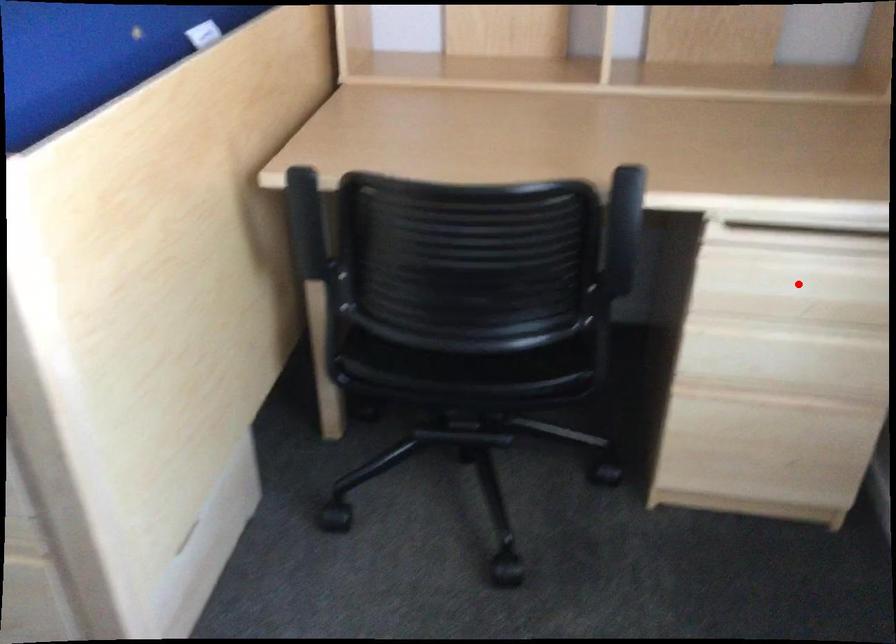
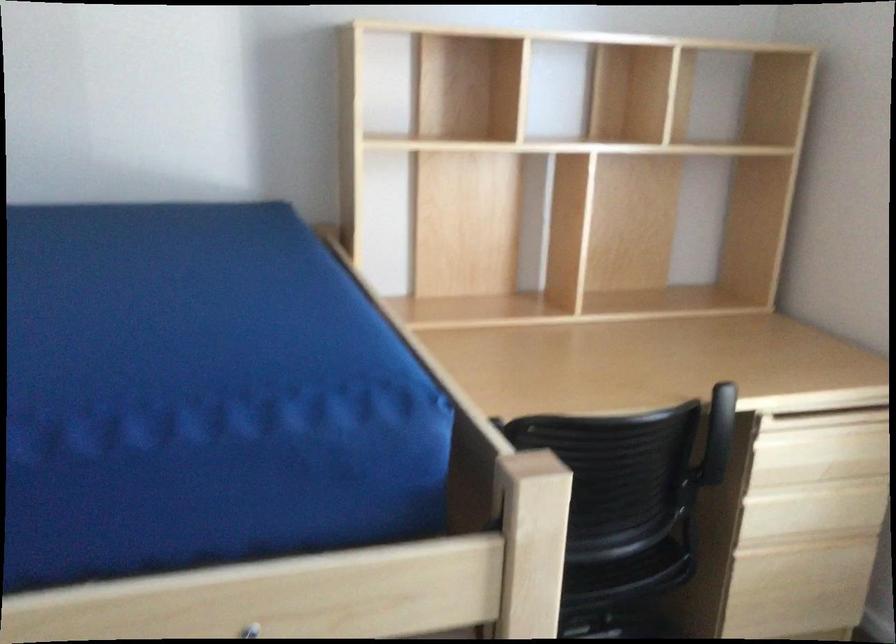
Question: I am providing you with two images of the same scene from different viewpoints. A red point is marked on the first image. At the location where the point appears in image 1, is it still visible in image 2?

Choices:
 (A) Yes
 (B) No

Answer: (A)